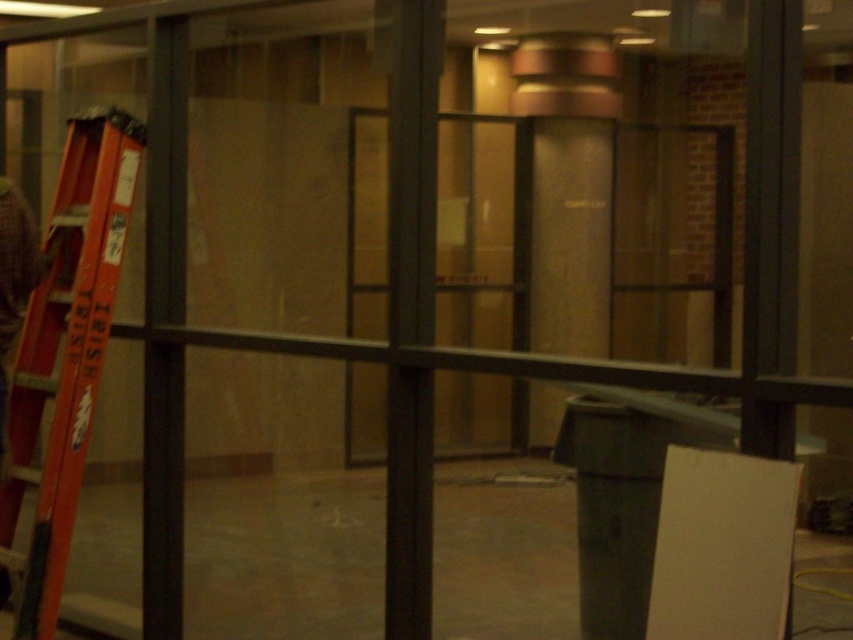
You are standing in the construction area and want to reach the point at the bottom of the ladder. Which point, point at coordinate (97, 294) or point at coordinate (405, 340), is closer to you?

Point at coordinate (97, 294) is closer to you because it is further to the camera than point at coordinate (405, 340).

You are standing at the entrance of the room and want to move to the glass partition in the foreground. Is the orange metallic ladder at left blocking your path?

The orange metallic ladder at left is positioned at point (67, 349), which is to the left side of the room. Since you are moving from the entrance towards the glass partition in the foreground, the ladder is not directly in your path. You can move around it to reach the glass partition.

You are a delivery person trying to navigate through the construction site. You need to pass between the orange metallic ladder at left and the black metal pole at center. Can you fit through the space between them?

The orange metallic ladder at left might be wider than black metal pole at center, so the space between them may not be wide enough for you to pass through safely. You should check the width before attempting to move through.